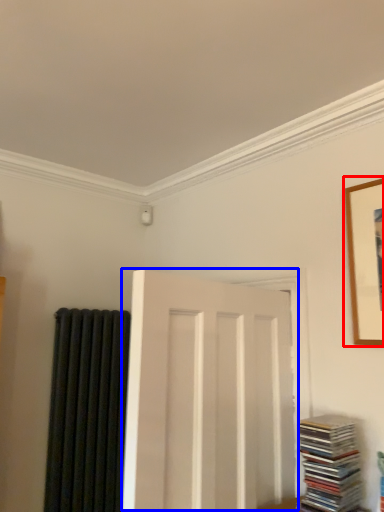
Question: Which object appears closest to the camera in this image, picture frame (highlighted by a red box) or door (highlighted by a blue box)?

Choices:
 (A) picture frame
 (B) door

Answer: (B)